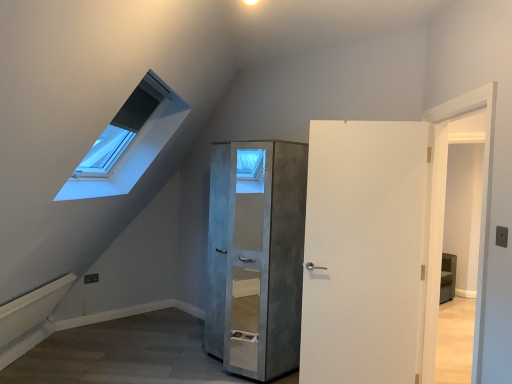
Question: In the image, is white matte door at center on the left side or the right side of concrete textured cabinet at center?

Choices:
 (A) right
 (B) left

Answer: (A)

Question: From their relative heights in the image, would you say white matte door at center is taller or shorter than concrete textured cabinet at center?

Choices:
 (A) short
 (B) tall

Answer: (A)

Question: From the image's perspective, is white matte door at center positioned above or below concrete textured cabinet at center?

Choices:
 (A) below
 (B) above

Answer: (B)

Question: Is point (236, 372) positioned closer to the camera than point (356, 296)?

Choices:
 (A) farther
 (B) closer

Answer: (A)

Question: From the image's perspective, is concrete textured cabinet at center positioned above or below white matte door at center?

Choices:
 (A) below
 (B) above

Answer: (A)

Question: In the image, is concrete textured cabinet at center on the left side or the right side of white matte door at center?

Choices:
 (A) right
 (B) left

Answer: (B)

Question: Based on their sizes in the image, would you say concrete textured cabinet at center is bigger or smaller than white matte door at center?

Choices:
 (A) big
 (B) small

Answer: (A)